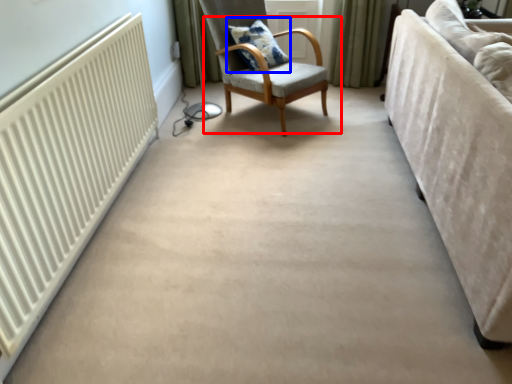
Question: Which of the following is the closest to the observer, chair (highlighted by a red box) or pillow (highlighted by a blue box)?

Choices:
 (A) chair
 (B) pillow

Answer: (A)